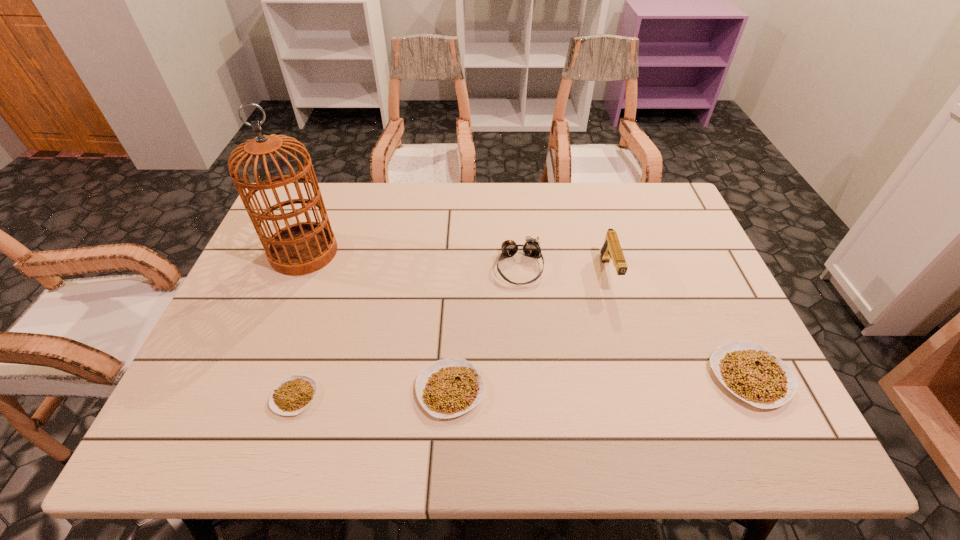
The image size is (960, 540). I want to click on the leftmost legume, so click(293, 394).

Identify the location of the shortest object. (293, 394).

Find the location of a particular element. The width and height of the screenshot is (960, 540). the second tallest legume is located at coordinates (448, 388).

Locate an element on the screen. the third object from left to right is located at coordinates (x=448, y=388).

You are a GUI agent. You are given a task and a screenshot of the screen. Output one action in this format:
    pyautogui.click(x=<x>, y=<y>)
    Task: Click on the rightmost object
    
    Given the screenshot: What is the action you would take?
    pyautogui.click(x=751, y=372)

The width and height of the screenshot is (960, 540). In order to click on birdcage in this screenshot , I will do `click(301, 248)`.

The height and width of the screenshot is (540, 960). In order to click on pistol in this screenshot , I will do `click(611, 249)`.

You are a GUI agent. You are given a task and a screenshot of the screen. Output one action in this format:
    pyautogui.click(x=<x>, y=<y>)
    Task: Click on the fifth object from left to right
    Image resolution: width=960 pixels, height=540 pixels.
    Given the screenshot: What is the action you would take?
    (x=611, y=249)

At what (x,y) coordinates should I click in order to perform the action: click on goggles. Please return your answer as a coordinate pair (x, y). This screenshot has width=960, height=540. Looking at the image, I should click on (531, 247).

Where is `the third object from right to left`? The height and width of the screenshot is (540, 960). the third object from right to left is located at coordinates (531, 247).